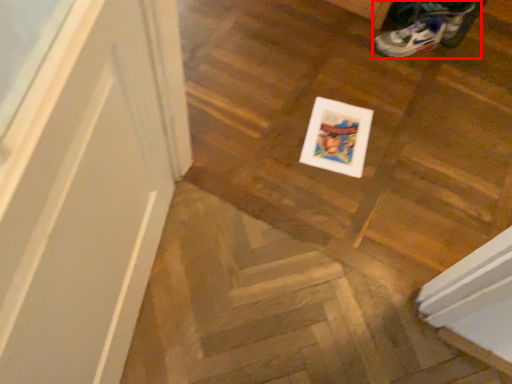
Question: From the image's perspective, where is footwear (annotated by the red box) located in relation to stairwell in the image?

Choices:
 (A) above
 (B) below

Answer: (A)